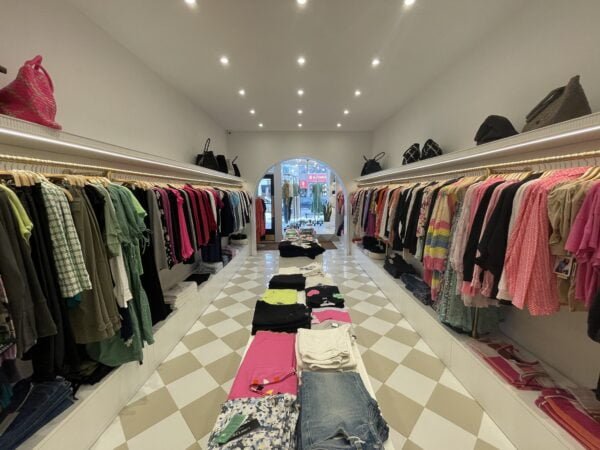
Locate an element on the screen. The image size is (600, 450). door push open is located at coordinates (273, 204).